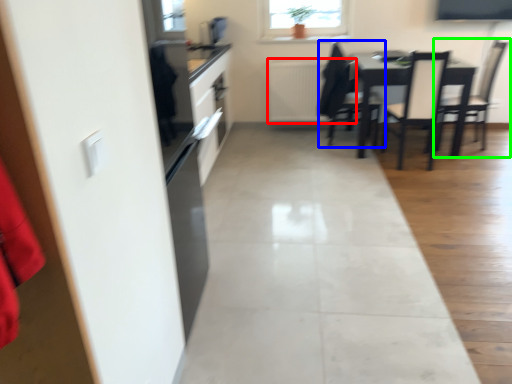
Question: Estimate the real-world distances between objects in this image. Which object is closer to radiator (highlighted by a red box), chair (highlighted by a blue box) or chair (highlighted by a green box)?

Choices:
 (A) chair
 (B) chair

Answer: (A)